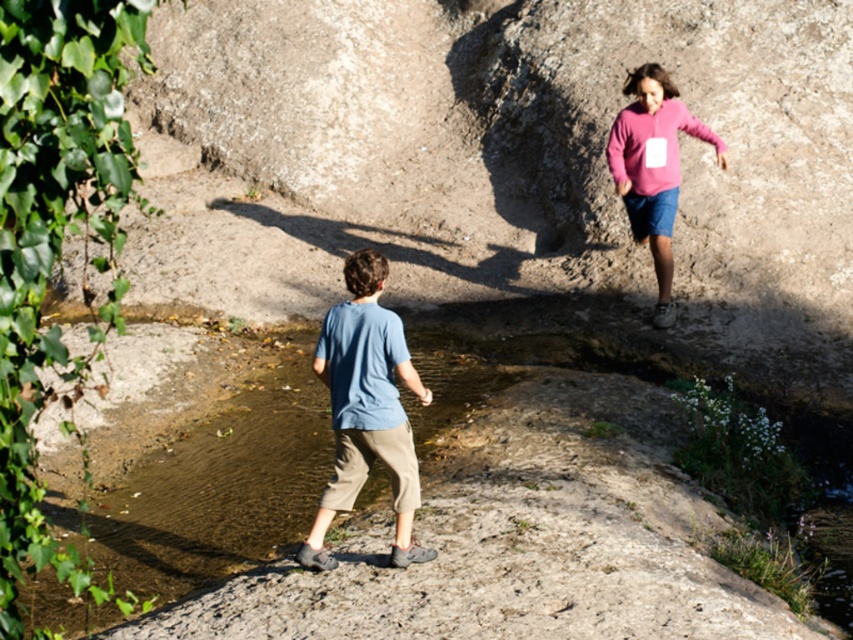
Who is more forward, [303,547] or [660,163]?

Point [303,547] is in front.

The image size is (853, 640). Identify the location of blue cotton shirt at center. (366, 408).

Between point (372, 385) and point (671, 220), which one is positioned in front?

Point (372, 385) is in front.

Identify the location of blue cotton shirt at center. The width and height of the screenshot is (853, 640). (366, 408).